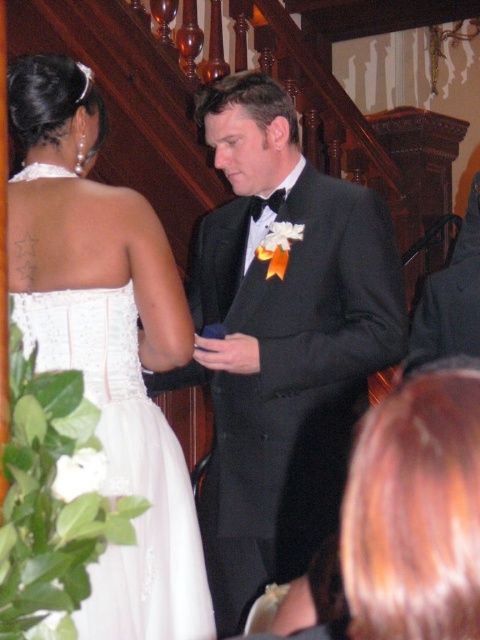
You are a photographer at the wedding and want to capture a closeup of the black satin tuxedo at center. Based on its position, where should you aim your camera?

The black satin tuxedo at center is located at the 2D coordinates point (x=282, y=340), so aim your camera at that position to capture the closeup.

You are a photographer at a wedding and need to adjust the lighting to ensure both the black satin tuxedo at center and the white lace dress at upper left are well lit. Based on their positions, which object is closer to the camera?

The white lace dress at upper left is closer to the camera because the black satin tuxedo at center is positioned under it, indicating it is further away.

Consider the image. You are a photographer adjusting your camera settings to focus on two points in the scene. The first point is point (240, 232) and the second is point (131, 486). Which point is closer to the camera?

Point (240, 232) is closer to the camera than point (131, 486).